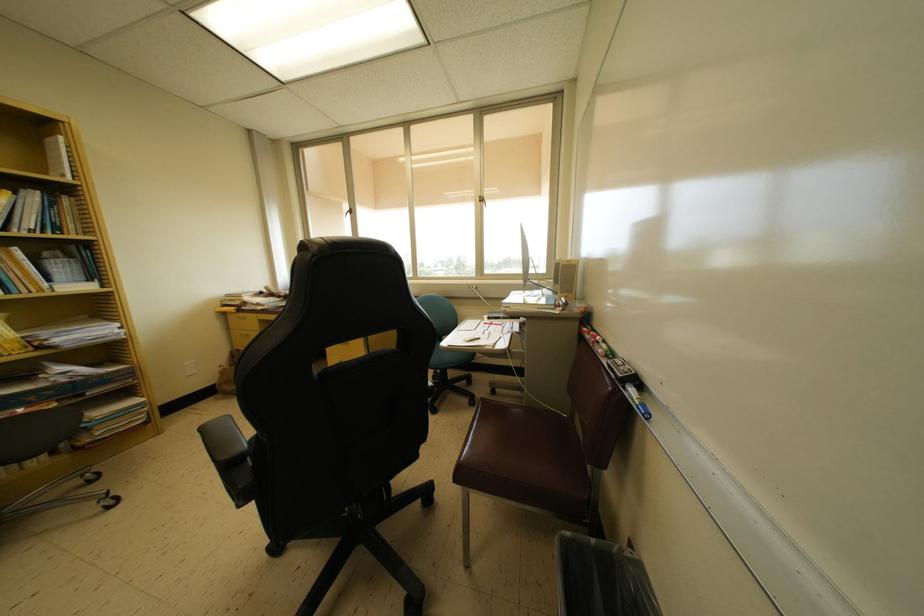
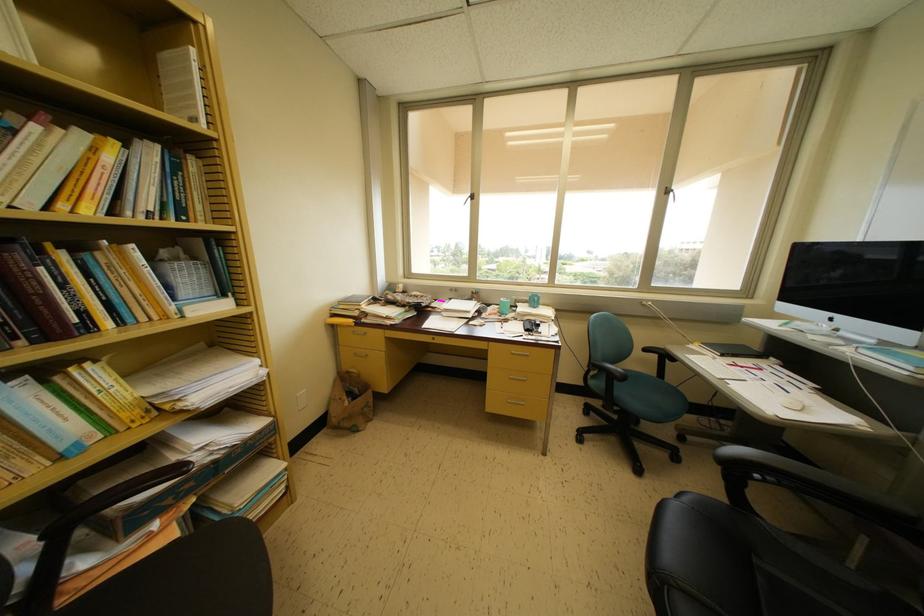
The point at (63, 257) is marked in the first image. Where is the corresponding point in the second image?

(181, 253)